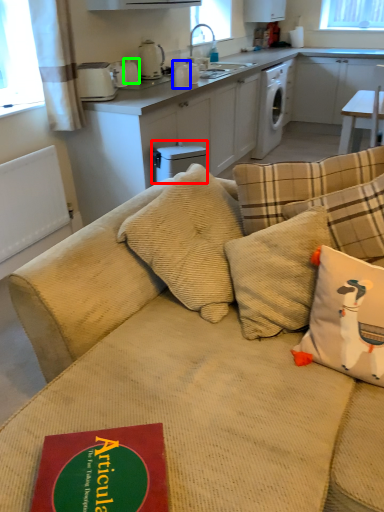
Question: Based on their relative distances, which object is farther from dish washer (highlighted by a red box)? Choose from appliance (highlighted by a blue box) and appliance (highlighted by a green box).

Choices:
 (A) appliance
 (B) appliance

Answer: (B)